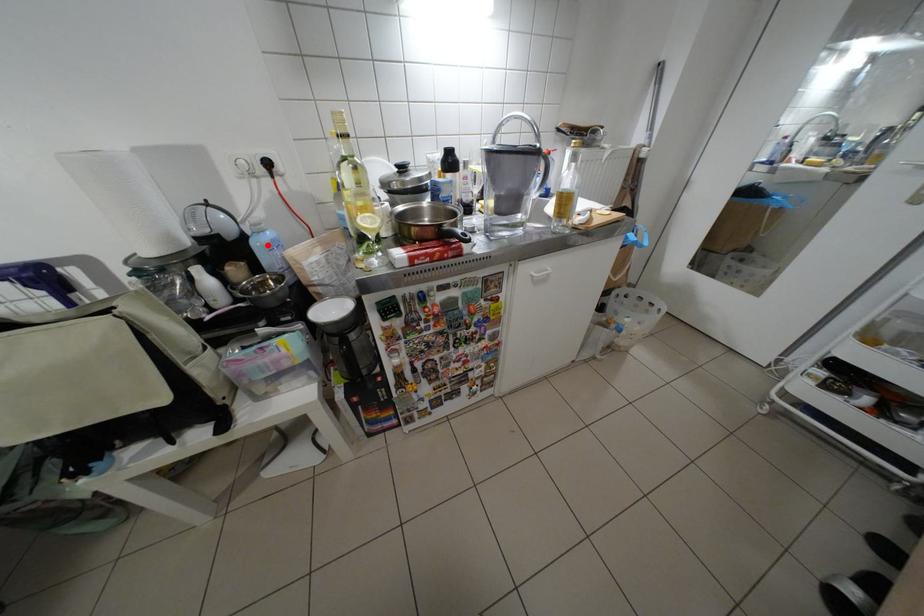
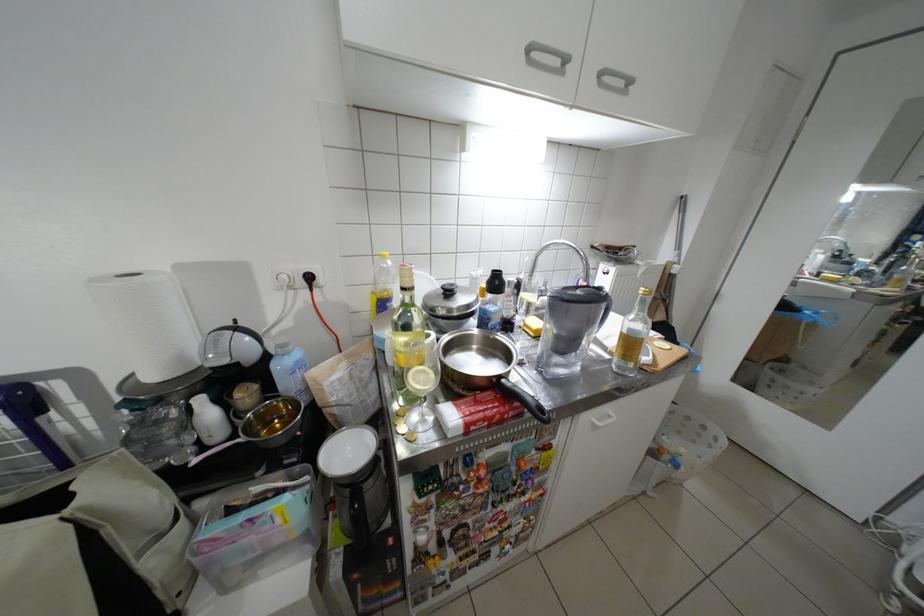
Locate, in the second image, the point that corresponds to the highlighted location in the first image.

(287, 367)